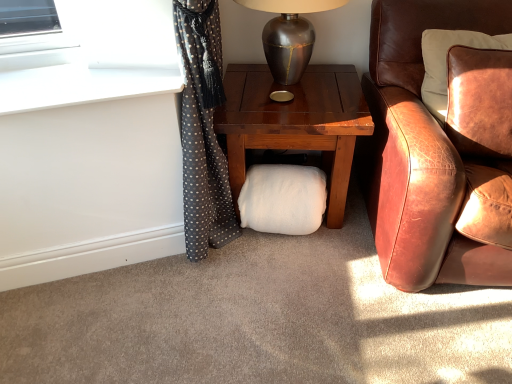
At what (x,y) coordinates should I click in order to perform the action: click on vacant space that is to the left of white fluffy pillow at center. Please return your answer as a coordinate pair (x, y). This screenshot has width=512, height=384. Looking at the image, I should click on (226, 251).